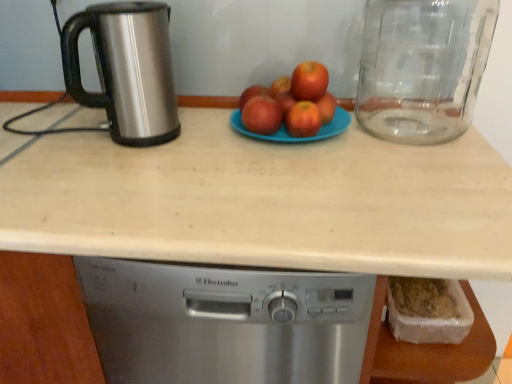
Question: Does stainless steel kettle at left have a lesser height compared to beige laminate countertop at center?

Choices:
 (A) yes
 (B) no

Answer: (A)

Question: Considering the relative sizes of stainless steel kettle at left and beige laminate countertop at center in the image provided, is stainless steel kettle at left taller than beige laminate countertop at center?

Choices:
 (A) yes
 (B) no

Answer: (B)

Question: From a real-world perspective, is stainless steel kettle at left beneath beige laminate countertop at center?

Choices:
 (A) yes
 (B) no

Answer: (B)

Question: From the image's perspective, is stainless steel kettle at left located beneath beige laminate countertop at center?

Choices:
 (A) yes
 (B) no

Answer: (B)

Question: Can you confirm if stainless steel kettle at left is positioned to the left of beige laminate countertop at center?

Choices:
 (A) no
 (B) yes

Answer: (B)

Question: Considering their positions, is red matte apples at center, the fifth apple viewed from the right, located in front of or behind red matte apple at center, marked as the sixth apple in a right-to-left arrangement?

Choices:
 (A) behind
 (B) front

Answer: (B)

Question: Considering the positions of point (253, 100) and point (243, 104), is point (253, 100) closer or farther from the camera than point (243, 104)?

Choices:
 (A) closer
 (B) farther

Answer: (A)

Question: Choose the correct answer: Is red matte apples at center, marked as the 2th apple in a left-to-right arrangement, inside red matte apple at center, marked as the sixth apple in a right-to-left arrangement, or outside it?

Choices:
 (A) inside
 (B) outside

Answer: (B)

Question: From their relative heights in the image, would you say red matte apples at center, marked as the 2th apple in a left-to-right arrangement, is taller or shorter than red matte apple at center, marked as the sixth apple in a right-to-left arrangement?

Choices:
 (A) short
 (B) tall

Answer: (B)

Question: Do you think red matte apple at center, positioned as the first apple in right-to-left order, is within transparent glass jar at right, or outside of it?

Choices:
 (A) outside
 (B) inside

Answer: (A)

Question: Considering their positions, is red matte apple at center, the 6th apple when ordered from left to right, located in front of or behind transparent glass jar at right?

Choices:
 (A) front
 (B) behind

Answer: (B)

Question: Considering the positions of red matte apple at center, positioned as the first apple in right-to-left order, and transparent glass jar at right in the image, is red matte apple at center, positioned as the first apple in right-to-left order, wider or thinner than transparent glass jar at right?

Choices:
 (A) thin
 (B) wide

Answer: (A)

Question: Considering the positions of red matte apple at center, positioned as the first apple in right-to-left order, and transparent glass jar at right in the image, is red matte apple at center, positioned as the first apple in right-to-left order, taller or shorter than transparent glass jar at right?

Choices:
 (A) tall
 (B) short

Answer: (B)

Question: From a real-world perspective, relative to stainless steel kettle at left, is matte blue plate at center vertically above or below?

Choices:
 (A) above
 (B) below

Answer: (B)

Question: Does point (264, 134) appear closer or farther from the camera than point (96, 24)?

Choices:
 (A) farther
 (B) closer

Answer: (A)